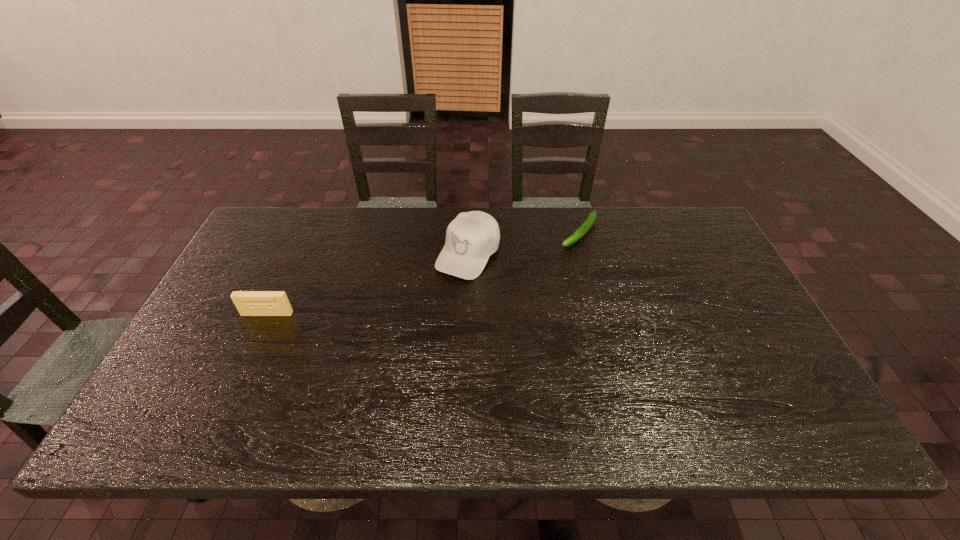
This screenshot has height=540, width=960. I want to click on videotape, so click(x=248, y=303).

Find the location of a particular element. The image size is (960, 540). the leftmost object is located at coordinates (248, 303).

This screenshot has height=540, width=960. In order to click on the shortest object in this screenshot , I will do `click(645, 330)`.

I want to click on baseball cap, so click(x=471, y=238).

At what (x,y) coordinates should I click in order to perform the action: click on the tallest object. Please return your answer as a coordinate pair (x, y). The height and width of the screenshot is (540, 960). Looking at the image, I should click on (471, 238).

You are a GUI agent. You are given a task and a screenshot of the screen. Output one action in this format:
    pyautogui.click(x=<x>, y=<y>)
    Task: Click on the zucchini
    Image resolution: width=960 pixels, height=540 pixels.
    Given the screenshot: What is the action you would take?
    pyautogui.click(x=586, y=226)

I want to click on vacant area situated 0.240m at the front of the videotape with spools, so click(228, 397).

You are a GUI agent. You are given a task and a screenshot of the screen. Output one action in this format:
    pyautogui.click(x=<x>, y=<y>)
    Task: Click on the vacant space located on the face of the shortest object
    
    Given the screenshot: What is the action you would take?
    pyautogui.click(x=593, y=330)

Locate an element on the screen. free region located on the face of the shortest object is located at coordinates (516, 330).

Find the location of a particular element. vacant space located 0.260m on the face of the shortest object is located at coordinates (523, 330).